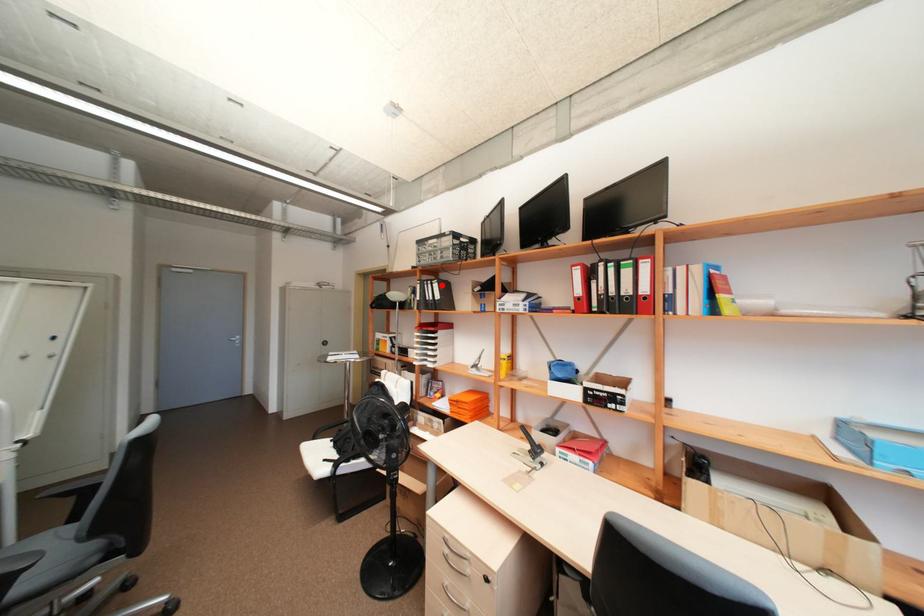
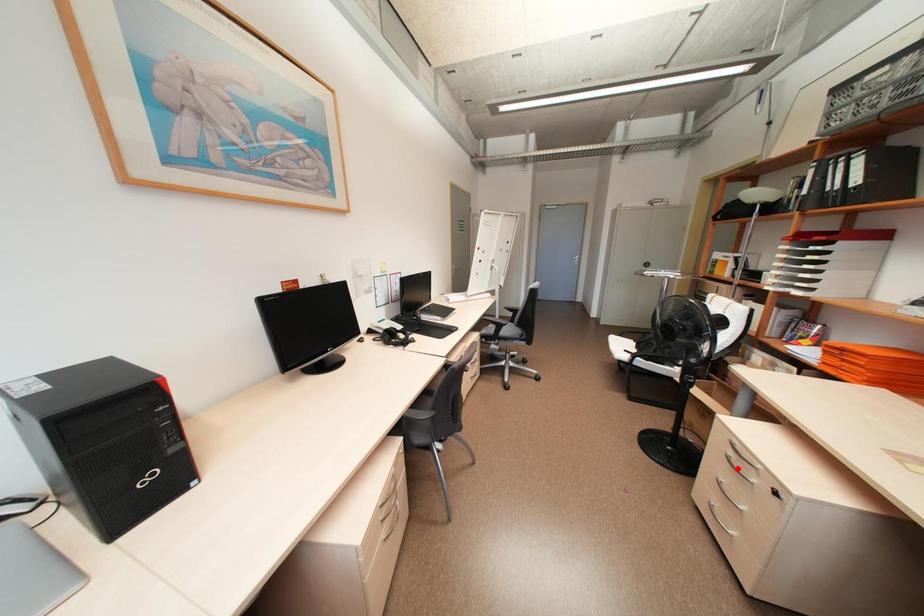
I am providing you with two images of the same scene from different viewpoints. A red point is marked on the first image and another point is marked on the second image. Does the point marked in image1 correspond to the same location as the one in image2?

No